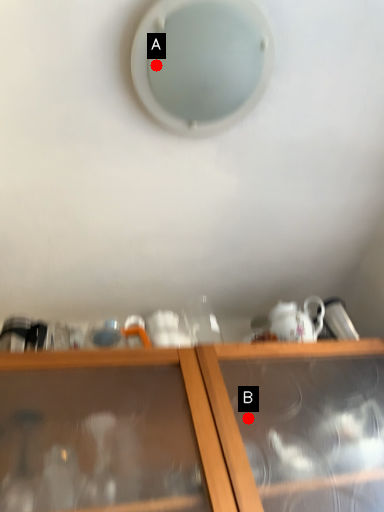
Question: Two points are circled on the image, labeled by A and B beside each circle. Which point is closer to the camera?

Choices:
 (A) A is closer
 (B) B is closer

Answer: (A)